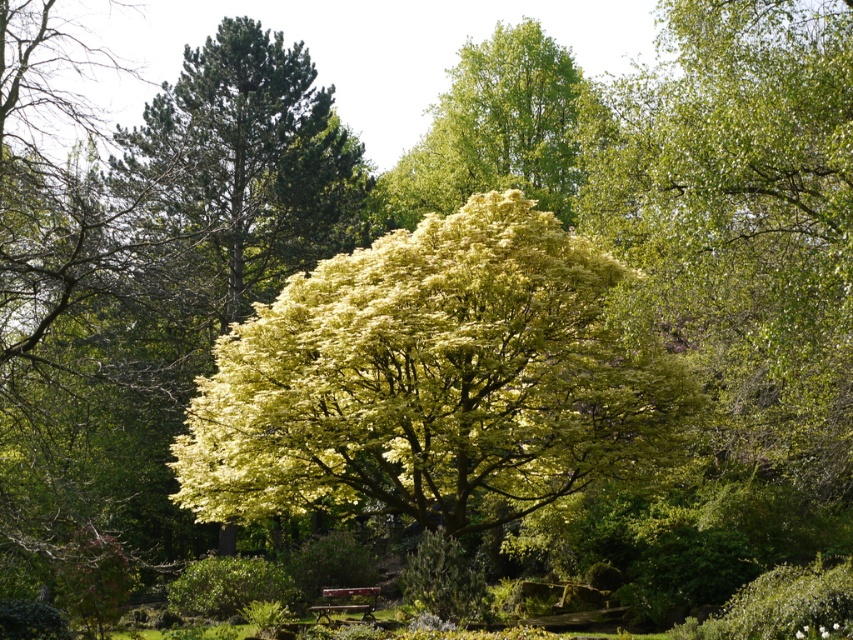
You are standing at the center of the image and want to locate the green leafy tree at upper center. Which direction should you look to find it?

You should look upward because the green leafy tree at upper center is located at point (x=498, y=131), which is in the upper part of the image.